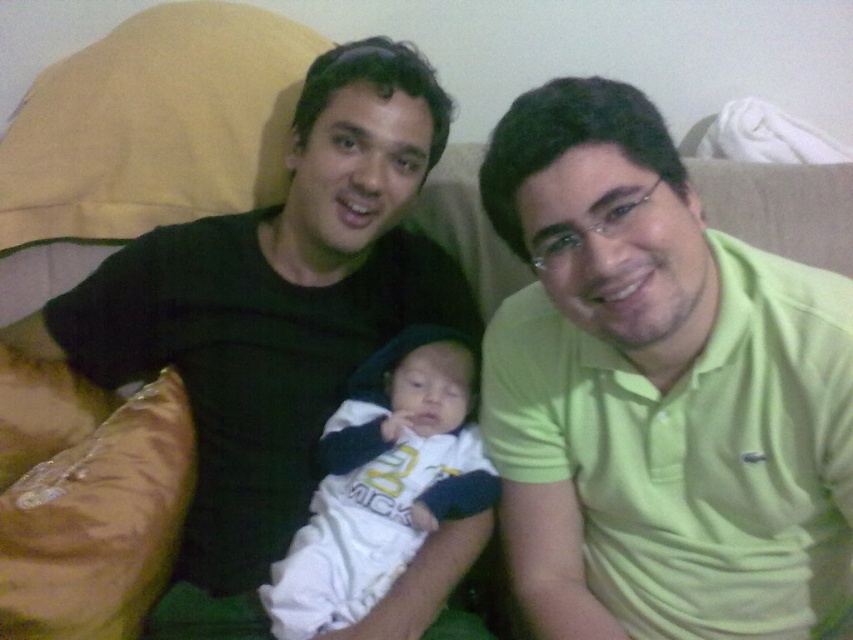
You are a photographer setting up a photo shoot. You need to ensure that the black matte shirt at center and the white soft fabric baby at center are both visible in the frame. Given their heights, which object should you position closer to the camera to maintain visibility?

The white soft fabric baby at center is shorter than the black matte shirt at center. To ensure both are visible, position the white soft fabric baby at center closer to the camera since it is shorter, allowing its details to be captured clearly while the taller black matte shirt at center can be slightly farther back but still within view.

You are a photographer trying to capture a group photo of the light green polo shirt at center and the black matte shirt at center. You need to ensure that both subjects are in focus. If your camera has a depth of field that can cover 12 inches, will both subjects be in focus?

The distance between the light green polo shirt at center and the black matte shirt at center is 12.32 inches. Since the camera can cover 12 inches, the subjects are slightly beyond the depth of field range, so one of them might be out of focus.